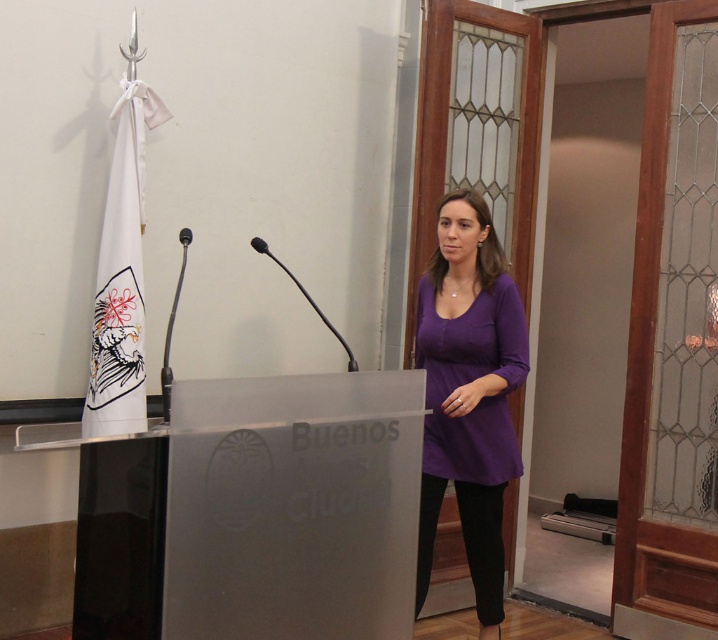
Is clear acrylic podium at center smaller than purple soft fabric shirt at center?

No, clear acrylic podium at center is not smaller than purple soft fabric shirt at center.

Does clear acrylic podium at center come behind purple soft fabric shirt at center?

No, it is not.

Is point (261, 522) farther from viewer compared to point (517, 340)?

No, (261, 522) is in front of (517, 340).

The height and width of the screenshot is (640, 718). I want to click on clear acrylic podium at center, so click(x=256, y=513).